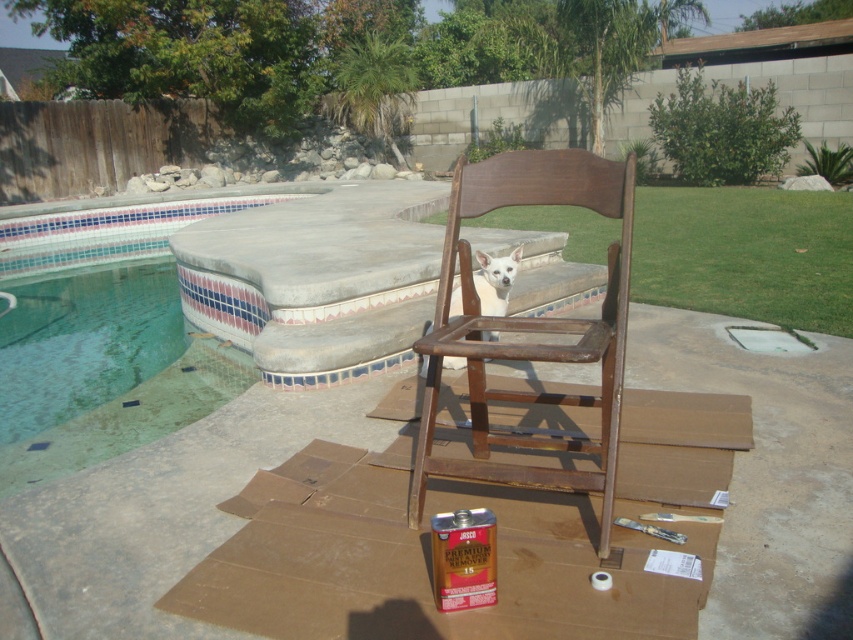
Question: Estimate the real-world distances between objects in this image. Which object is farther from the white smooth dog at center?

Choices:
 (A) green tile swimming pool at upper left
 (B) rustic wood chair at center

Answer: (A)

Question: From the image, what is the correct spatial relationship of green tile swimming pool at upper left in relation to white smooth dog at center?

Choices:
 (A) above
 (B) below

Answer: (A)

Question: Which point is farther from the camera taking this photo?

Choices:
 (A) (506, 266)
 (B) (15, 259)

Answer: (B)

Question: Which object is the farthest from the white smooth dog at center?

Choices:
 (A) green tile swimming pool at upper left
 (B) rustic wood chair at center

Answer: (A)

Question: Is green tile swimming pool at upper left behind rustic wood chair at center?

Choices:
 (A) no
 (B) yes

Answer: (B)

Question: Considering the relative positions of rustic wood chair at center and white smooth dog at center in the image provided, where is rustic wood chair at center located with respect to white smooth dog at center?

Choices:
 (A) right
 (B) left

Answer: (A)